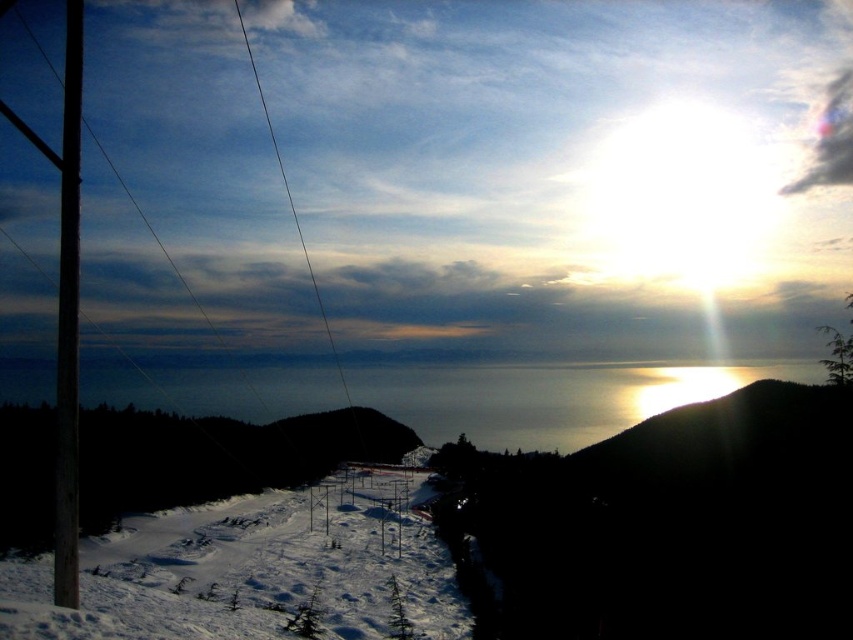
You are a skier planning to take a photo of the silvery metallic hillside at upper right and the smooth wooden pole at left. From your current position, which object should you aim your camera towards first to capture both in one frame?

You should aim your camera towards the smooth wooden pole at left first since the silvery metallic hillside at upper right is to the right of it, allowing both objects to be included in the same frame when positioned correctly.

You are a skier preparing to descend the white snow ski slope at center and notice the smooth wire at center in your path. Which object will you encounter first as you start your descent?

You will encounter the white snow ski slope at center first because it is closer to the viewer than the smooth wire at center.

You are planning to install a new ski lift cable that needs to be anchored to the highest point between the silvery metallic hillside at upper right and the smooth wire at center. Which object should you choose as the anchor point?

The smooth wire at center is taller than the silvery metallic hillside at upper right, so you should anchor the ski lift cable to the smooth wire at center as it is the higher point.